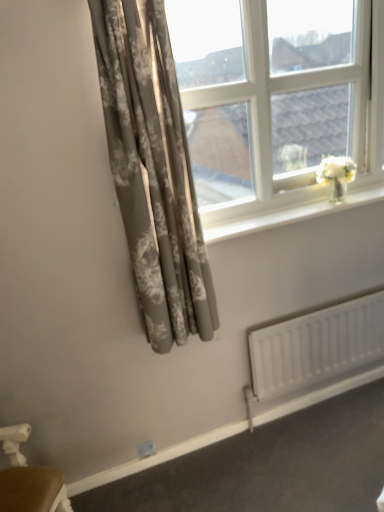
Where is `vacant region below matte gray floral curtain at left (from a real-world perspective)`? The width and height of the screenshot is (384, 512). vacant region below matte gray floral curtain at left (from a real-world perspective) is located at coordinates (205, 459).